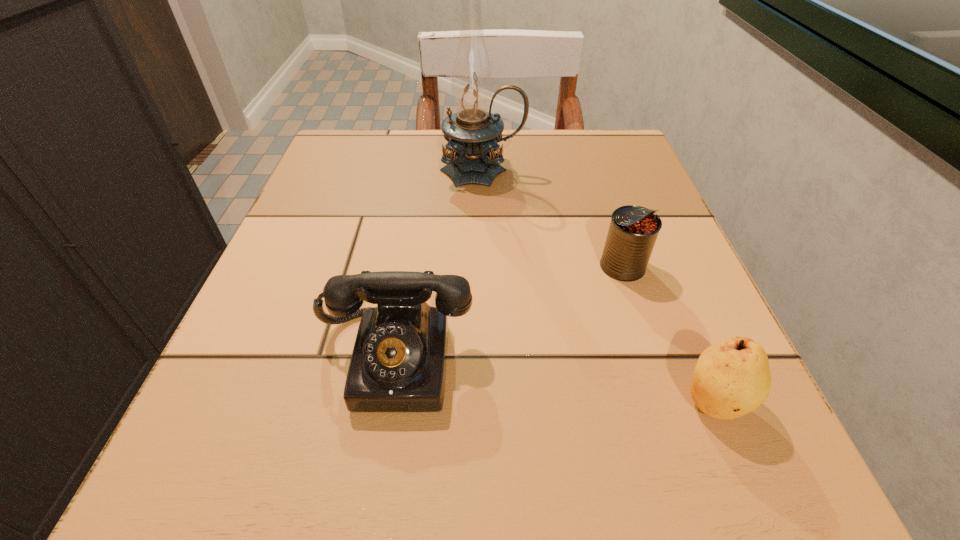
This screenshot has height=540, width=960. In order to click on vacant region between the can and the telephone in this screenshot , I will do `click(509, 313)`.

Find the location of `free space that is in between the oil lamp and the third nearest object`. free space that is in between the oil lamp and the third nearest object is located at coordinates (552, 219).

The height and width of the screenshot is (540, 960). In order to click on unoccupied position between the can and the tallest object in this screenshot , I will do [x=552, y=219].

This screenshot has width=960, height=540. I want to click on vacant space that is in between the pear and the tallest object, so click(598, 286).

This screenshot has height=540, width=960. What are the coordinates of `free point between the oil lamp and the third nearest object` in the screenshot? It's located at (552, 219).

You are a GUI agent. You are given a task and a screenshot of the screen. Output one action in this format:
    pyautogui.click(x=<x>, y=<y>)
    Task: Click on the vacant area that lies between the oil lamp and the telephone
    The image size is (960, 540).
    Given the screenshot: What is the action you would take?
    pyautogui.click(x=439, y=265)

Locate an element on the screen. The image size is (960, 540). free space that is in between the farthest object and the third nearest object is located at coordinates (552, 219).

I want to click on vacant region between the telephone and the third nearest object, so click(509, 313).

Where is `vacant area that lies between the pear and the oil lamp`? vacant area that lies between the pear and the oil lamp is located at coordinates (598, 286).

You are a GUI agent. You are given a task and a screenshot of the screen. Output one action in this format:
    pyautogui.click(x=<x>, y=<y>)
    Task: Click on the free spot between the pear and the third nearest object
    This screenshot has height=540, width=960.
    Given the screenshot: What is the action you would take?
    pyautogui.click(x=668, y=334)